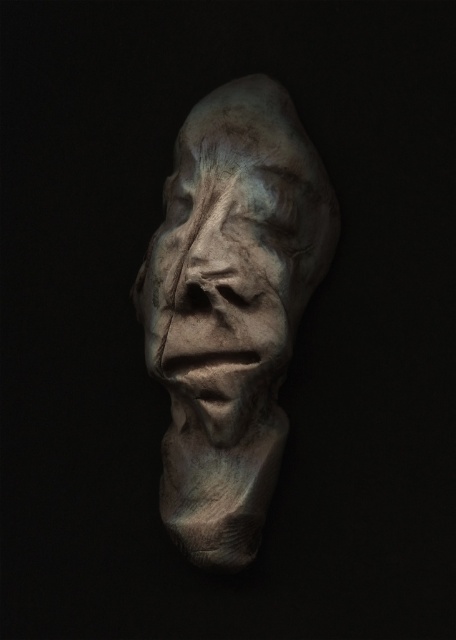
Question: Can you confirm if matte stone sculpture at center is bigger than matte stone face at center?

Choices:
 (A) no
 (B) yes

Answer: (B)

Question: Is matte stone sculpture at center to the left of matte stone face at center from the viewer's perspective?

Choices:
 (A) yes
 (B) no

Answer: (B)

Question: Which of the following is the farthest from the observer?

Choices:
 (A) matte stone face at center
 (B) matte stone sculpture at center

Answer: (B)

Question: Which of the following is the closest to the observer?

Choices:
 (A) matte stone face at center
 (B) matte stone sculpture at center

Answer: (A)

Question: Does matte stone sculpture at center appear under matte stone face at center?

Choices:
 (A) yes
 (B) no

Answer: (A)

Question: Which object appears closest to the camera in this image?

Choices:
 (A) matte stone face at center
 (B) matte stone sculpture at center

Answer: (A)